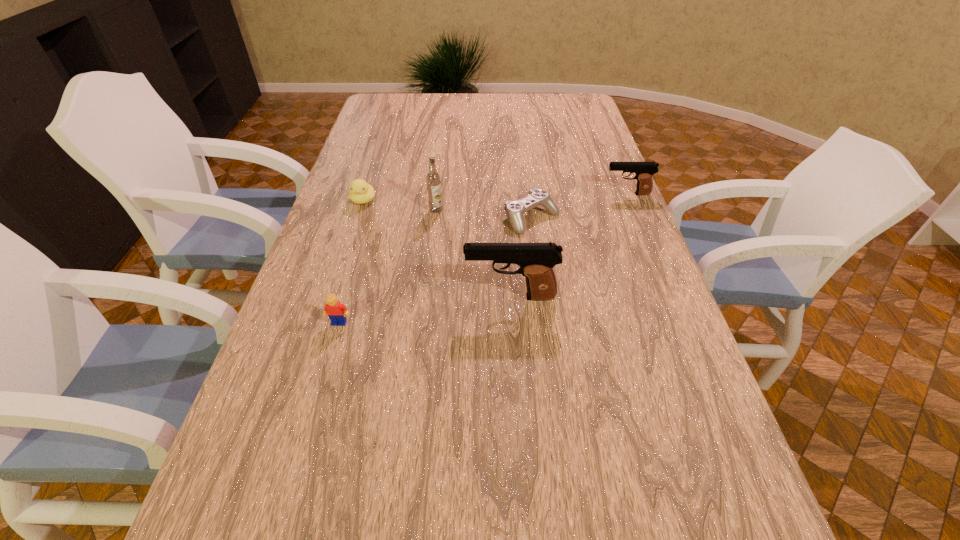
The width and height of the screenshot is (960, 540). What are the coordinates of `the nearer pistol` in the screenshot? It's located at (536, 260).

Identify the location of the taller pistol. Image resolution: width=960 pixels, height=540 pixels. (536, 260).

I want to click on the rightmost object, so click(x=644, y=171).

Identify the location of the shorter pistol. This screenshot has height=540, width=960. coord(644,171).

Locate an element on the screen. This screenshot has height=540, width=960. the nearest object is located at coordinates (337, 312).

Locate an element on the screen. The width and height of the screenshot is (960, 540). the shortest object is located at coordinates (514, 210).

The image size is (960, 540). In order to click on the fifth tallest object in this screenshot , I will do `click(361, 192)`.

You are a GUI agent. You are given a task and a screenshot of the screen. Output one action in this format:
    pyautogui.click(x=<x>, y=<y>)
    Task: Click on the vodka
    This screenshot has height=540, width=960.
    Given the screenshot: What is the action you would take?
    pyautogui.click(x=433, y=178)

Locate an element on the screen. The image size is (960, 540). free space located at the barrel of the taller pistol is located at coordinates (348, 297).

Image resolution: width=960 pixels, height=540 pixels. Identify the location of vacant space located at the barrel of the taller pistol. (320, 297).